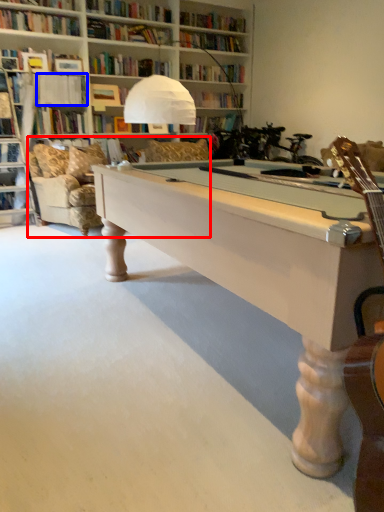
Question: Which of the following is the closest to the observer, couch (highlighted by a red box) or book (highlighted by a blue box)?

Choices:
 (A) couch
 (B) book

Answer: (A)